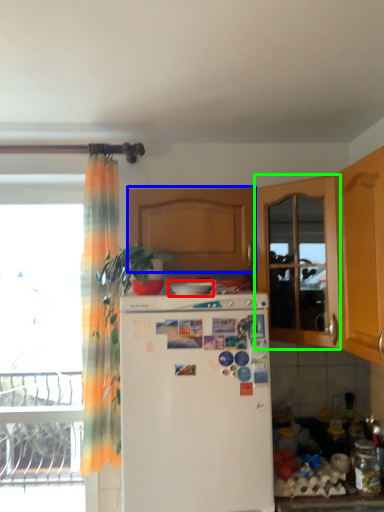
Question: Estimate the real-world distances between objects in this image. Which object is closer to appliance (highlighted by a red box), cabinetry (highlighted by a blue box) or screen door (highlighted by a green box)?

Choices:
 (A) cabinetry
 (B) screen door

Answer: (A)